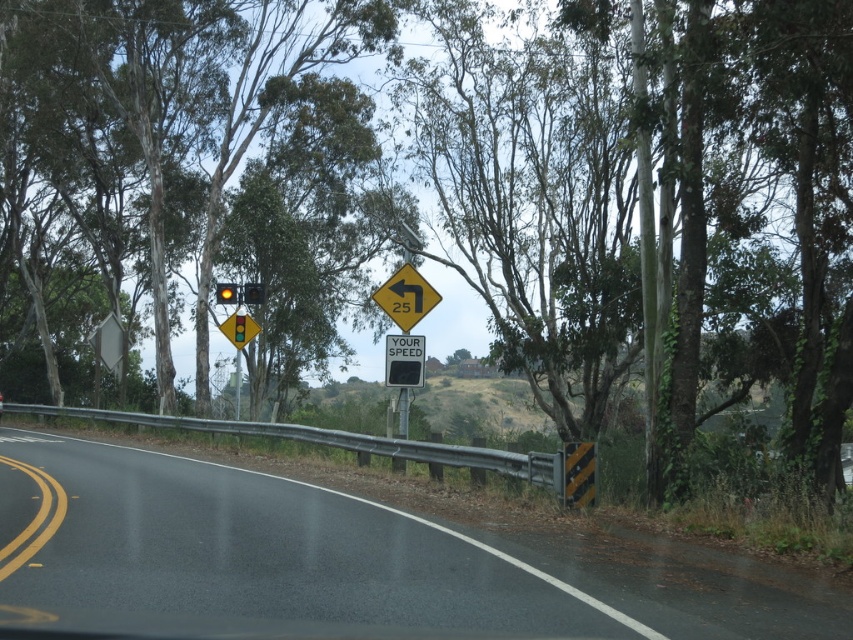
How much distance is there between green leafy tree at upper left and yellow reflective plastic at center?

green leafy tree at upper left and yellow reflective plastic at center are 24.31 meters apart from each other.

Who is taller, green leafy tree at upper left or yellow reflective plastic at center?

With more height is green leafy tree at upper left.

Which is in front, point (144, 109) or point (396, 292)?

Point (396, 292) is in front.

At what (x,y) coordinates should I click in order to perform the action: click on green leafy tree at upper left. Please return your answer as a coordinate pair (x, y). The image size is (853, 640). Looking at the image, I should click on (270, 106).

Based on the photo, does white plastic speedometer at center have a larger size compared to amber glass traffic light at upper center?

Indeed, white plastic speedometer at center has a larger size compared to amber glass traffic light at upper center.

Looking at this image, is white plastic speedometer at center smaller than amber glass traffic light at upper center?

No.

Does point (405, 369) lie behind point (221, 304)?

No, it is not.

You are a GUI agent. You are given a task and a screenshot of the screen. Output one action in this format:
    pyautogui.click(x=<x>, y=<y>)
    Task: Click on the white plastic speedometer at center
    
    Given the screenshot: What is the action you would take?
    pyautogui.click(x=404, y=360)

Who is more distant from viewer, (276, 547) or (260, 284)?

The point (260, 284) is behind.

Does point (18, 515) come closer to viewer compared to point (247, 288)?

Yes, it is.

Find the location of a particular element. This screenshot has height=640, width=853. black asphalt road at center is located at coordinates (355, 560).